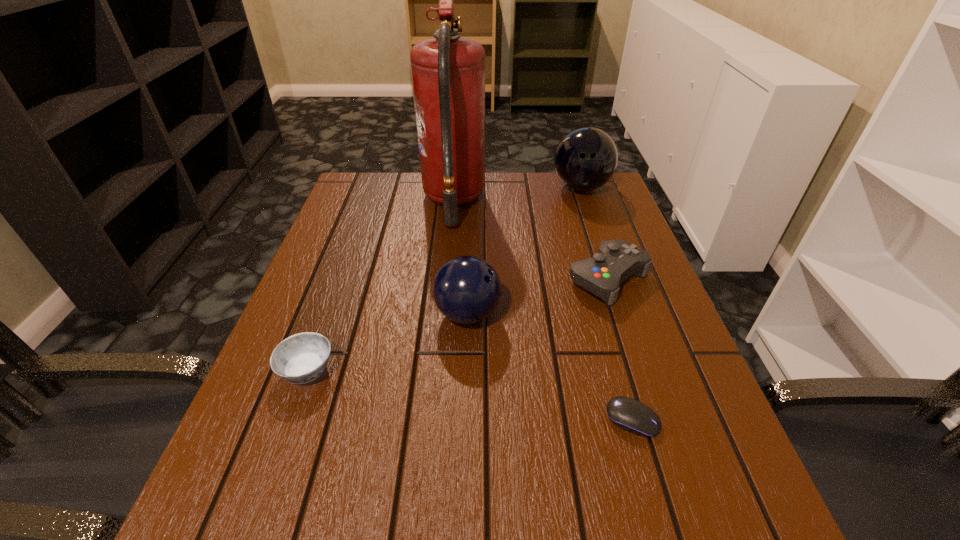
The height and width of the screenshot is (540, 960). Identify the location of fire extinguisher. pos(448,72).

This screenshot has width=960, height=540. What are the coordinates of `the farther bowling ball` in the screenshot? It's located at (585, 159).

You are a GUI agent. You are given a task and a screenshot of the screen. Output one action in this format:
    pyautogui.click(x=<x>, y=<y>)
    Task: Click on the fifth shortest object
    This screenshot has width=960, height=540.
    Given the screenshot: What is the action you would take?
    pyautogui.click(x=585, y=159)

The width and height of the screenshot is (960, 540). I want to click on the third tallest object, so click(x=467, y=289).

Locate an element on the screen. This screenshot has height=540, width=960. the nearer bowling ball is located at coordinates (467, 289).

Where is `the fourth tallest object`? This screenshot has width=960, height=540. the fourth tallest object is located at coordinates (616, 260).

Find the location of `the leftmost object`. the leftmost object is located at coordinates (301, 358).

The height and width of the screenshot is (540, 960). I want to click on ashtray, so pyautogui.click(x=301, y=358).

Where is `the nearest object`? This screenshot has width=960, height=540. the nearest object is located at coordinates (627, 413).

Find the location of a particular element. This screenshot has width=960, height=540. computer mouse is located at coordinates (627, 413).